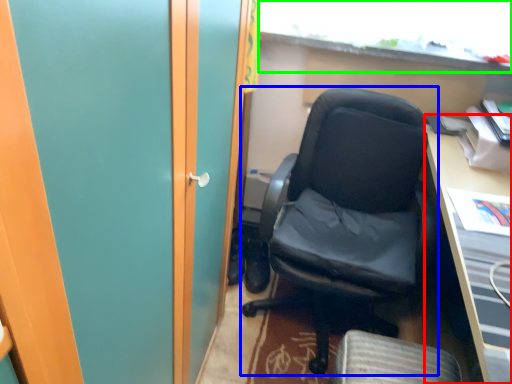
Question: Which object is the farthest from desk (highlighted by a red box)? Choose among these: chair (highlighted by a blue box) or window (highlighted by a green box).

Choices:
 (A) chair
 (B) window

Answer: (B)